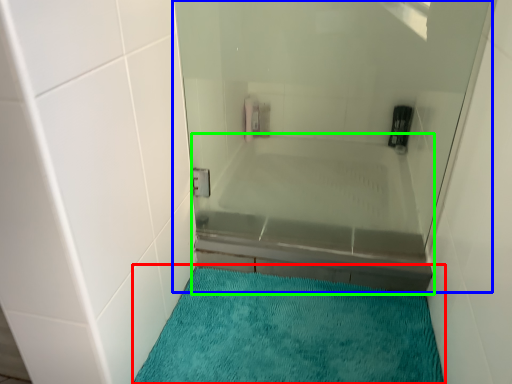
Question: Which object is the farthest from bath mat (highlighted by a red box)? Choose among these: shower door (highlighted by a blue box) or bathtub (highlighted by a green box).

Choices:
 (A) shower door
 (B) bathtub

Answer: (A)